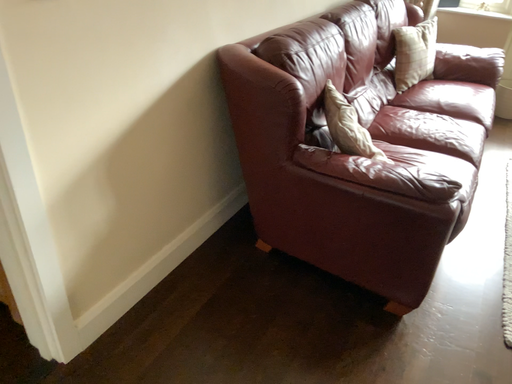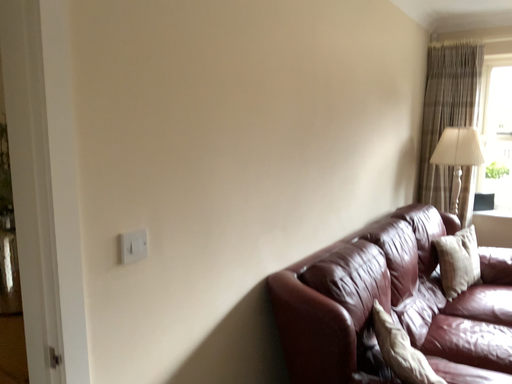
Question: How did the camera likely rotate when shooting the video?

Choices:
 (A) rotated downward
 (B) rotated upward

Answer: (B)